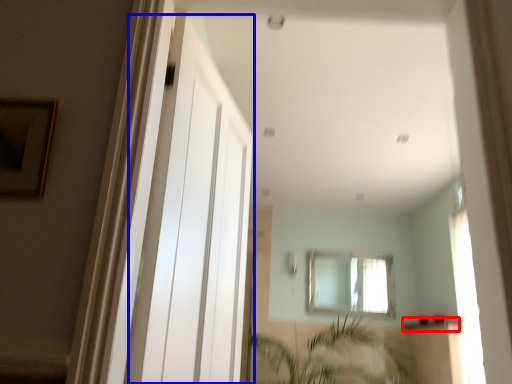
Question: Which point is further to the camera, window sill (highlighted by a red box) or screen door (highlighted by a blue box)?

Choices:
 (A) window sill
 (B) screen door

Answer: (A)